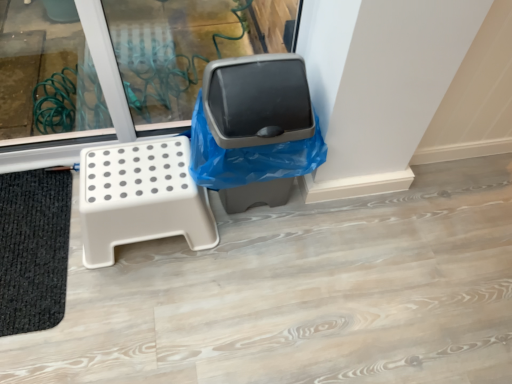
You are a GUI agent. You are given a task and a screenshot of the screen. Output one action in this format:
    pyautogui.click(x=<x>, y=<y>)
    Task: Click on the vacant area that is in front of matte plastic trash can at center
    The width and height of the screenshot is (512, 384).
    Given the screenshot: What is the action you would take?
    pyautogui.click(x=243, y=271)